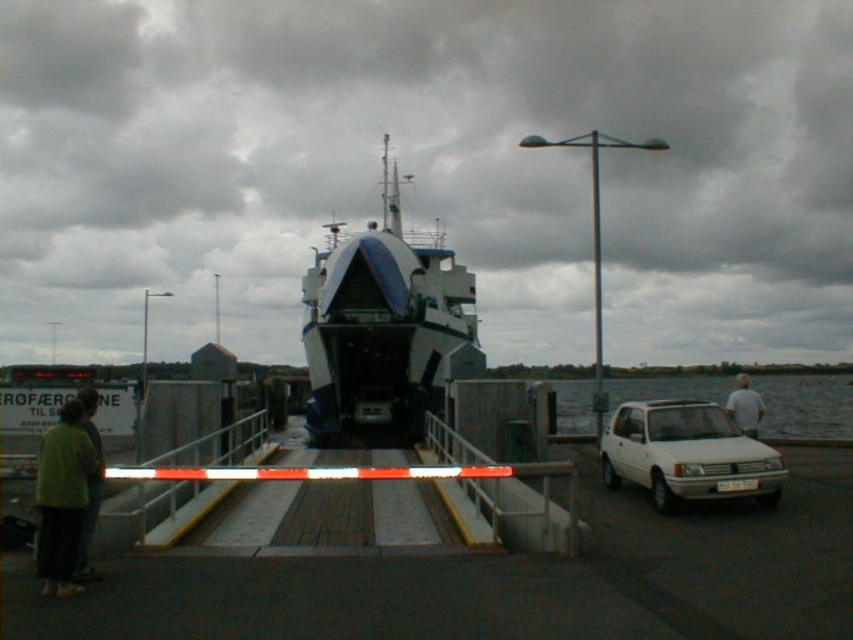
Between point (683, 492) and point (729, 401), which one is positioned behind?

The point (729, 401) is more distant.

Can you confirm if white matte car at lower right is bigger than white cotton shirt at right?

No, white matte car at lower right is not bigger than white cotton shirt at right.

Locate an element on the screen. This screenshot has width=853, height=640. white matte car at lower right is located at coordinates (688, 454).

Can you confirm if green fabric jacket at lower left is thinner than white cotton shirt at right?

Correct, green fabric jacket at lower left's width is less than white cotton shirt at right's.

Which is behind, point (86, 540) or point (730, 410)?

The point (730, 410) is behind.

In order to click on green fabric jacket at lower left in this screenshot , I will do `click(90, 486)`.

Who is lower down, blue matte boat at center or yellow-green shirt at left?

yellow-green shirt at left

What do you see at coordinates (384, 326) in the screenshot?
I see `blue matte boat at center` at bounding box center [384, 326].

This screenshot has width=853, height=640. In order to click on blue matte boat at center in this screenshot , I will do `click(384, 326)`.